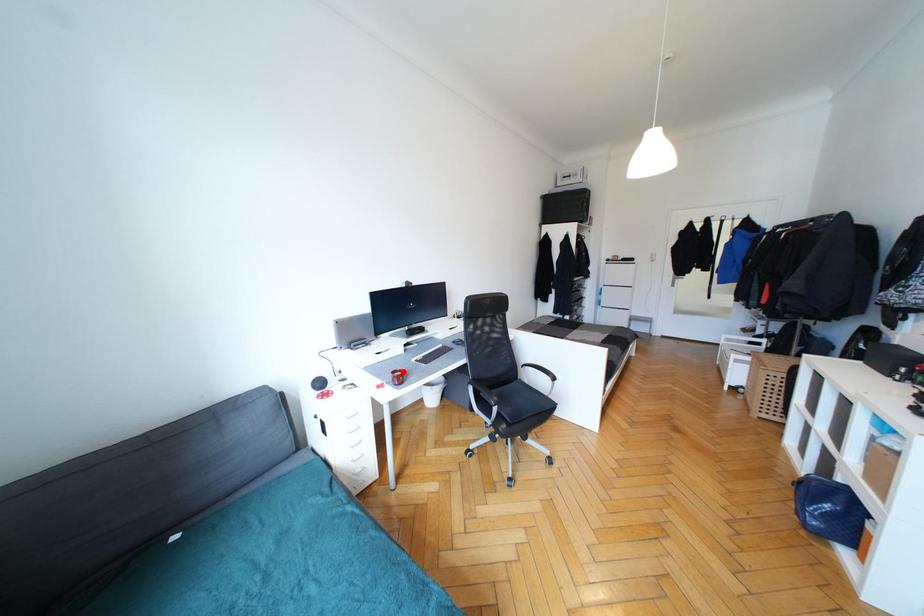
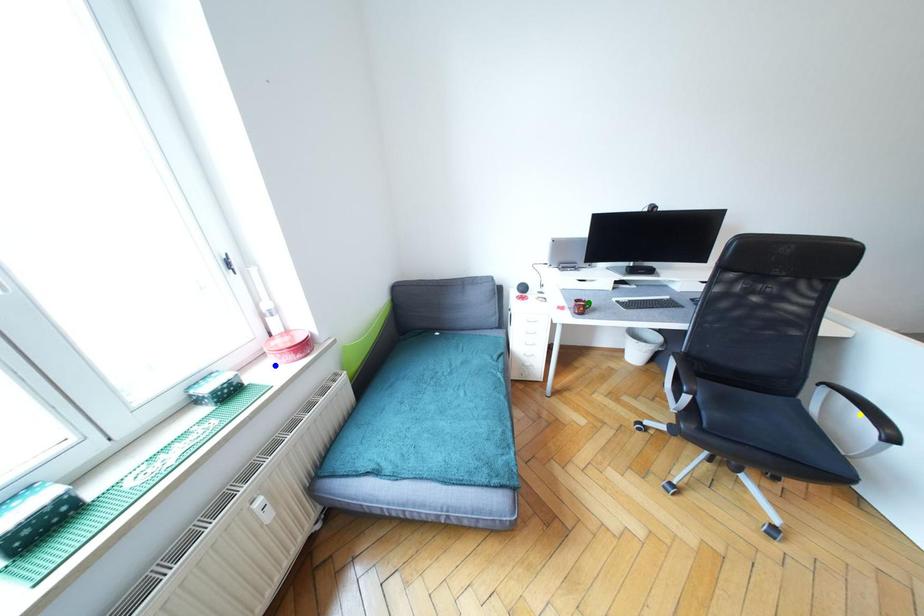
Question: I am providing you with two images of the same scene from different viewpoints. A red point is marked on the first image. You are given multiple points on the second image. Which point in image 2 is actually the same real-world point as the red point in image 1?

Choices:
 (A) yellow point
 (B) blue point
 (C) green point

Answer: (C)